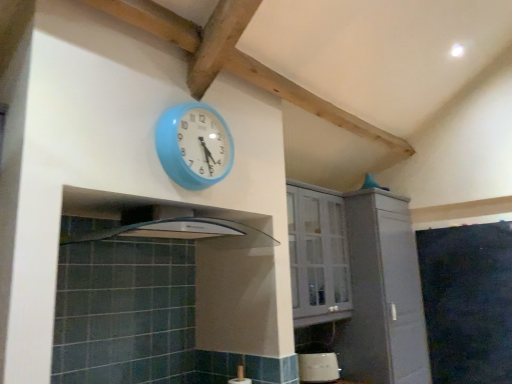
Question: Is white matte cabinet at center, which is counted as the 2th cabinetry, starting from the left, wider than black matte chalkboard at right?

Choices:
 (A) no
 (B) yes

Answer: (B)

Question: Considering the relative sizes of white matte cabinet at center, which is the first cabinetry in right-to-left order, and black matte chalkboard at right in the image provided, is white matte cabinet at center, which is the first cabinetry in right-to-left order, taller than black matte chalkboard at right?

Choices:
 (A) no
 (B) yes

Answer: (B)

Question: Is white matte cabinet at center, which is counted as the 2th cabinetry, starting from the left, oriented towards black matte chalkboard at right?

Choices:
 (A) no
 (B) yes

Answer: (B)

Question: From the image's perspective, is white matte cabinet at center, which is the first cabinetry in right-to-left order, over black matte chalkboard at right?

Choices:
 (A) yes
 (B) no

Answer: (A)

Question: Is white matte cabinet at center, which is the first cabinetry in right-to-left order, outside of black matte chalkboard at right?

Choices:
 (A) no
 (B) yes

Answer: (B)

Question: Is white matte cabinet at center, which is counted as the 2th cabinetry, starting from the left, closer to the viewer compared to black matte chalkboard at right?

Choices:
 (A) no
 (B) yes

Answer: (B)

Question: From a real-world perspective, does black matte chalkboard at right stand above white matte cabinet at center, which is the first cabinetry in right-to-left order?

Choices:
 (A) yes
 (B) no

Answer: (B)

Question: Is black matte chalkboard at right smaller than white matte cabinet at center, which is counted as the 2th cabinetry, starting from the left?

Choices:
 (A) no
 (B) yes

Answer: (B)

Question: Does black matte chalkboard at right have a larger size compared to white matte cabinet at center, which is counted as the 2th cabinetry, starting from the left?

Choices:
 (A) no
 (B) yes

Answer: (A)

Question: Does black matte chalkboard at right have a greater height compared to white matte cabinet at center, which is counted as the 2th cabinetry, starting from the left?

Choices:
 (A) yes
 (B) no

Answer: (B)

Question: Is the surface of black matte chalkboard at right in direct contact with white matte cabinet at center, which is the first cabinetry in right-to-left order?

Choices:
 (A) yes
 (B) no

Answer: (B)

Question: Is white matte cabinet at center, which is the first cabinetry in right-to-left order, a part of black matte chalkboard at right?

Choices:
 (A) no
 (B) yes

Answer: (A)

Question: From the image's perspective, would you say black matte chalkboard at right is shown under white glossy toaster at lower center?

Choices:
 (A) yes
 (B) no

Answer: (B)